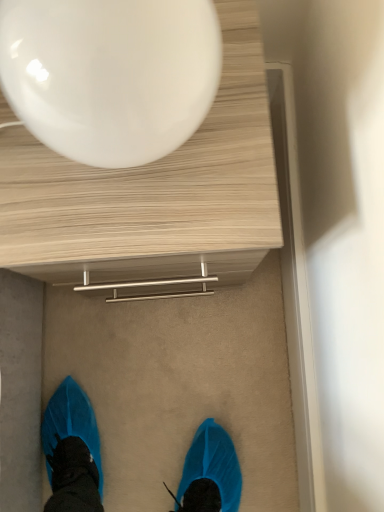
Question: In the image, is wooden table at upper center positioned in front of or behind glossy white balloon at upper center?

Choices:
 (A) front
 (B) behind

Answer: (B)

Question: Looking at their shapes, would you say wooden table at upper center is wider or thinner than glossy white balloon at upper center?

Choices:
 (A) thin
 (B) wide

Answer: (B)

Question: Would you say wooden table at upper center is to the left or to the right of glossy white balloon at upper center in the picture?

Choices:
 (A) right
 (B) left

Answer: (A)

Question: Do you think glossy white balloon at upper center is within wooden table at upper center, or outside of it?

Choices:
 (A) inside
 (B) outside

Answer: (B)

Question: In terms of width, does glossy white balloon at upper center look wider or thinner when compared to wooden table at upper center?

Choices:
 (A) thin
 (B) wide

Answer: (A)

Question: Based on their positions, is glossy white balloon at upper center located to the left or right of wooden table at upper center?

Choices:
 (A) right
 (B) left

Answer: (B)

Question: In the image, is glossy white balloon at upper center positioned in front of or behind wooden table at upper center?

Choices:
 (A) front
 (B) behind

Answer: (A)